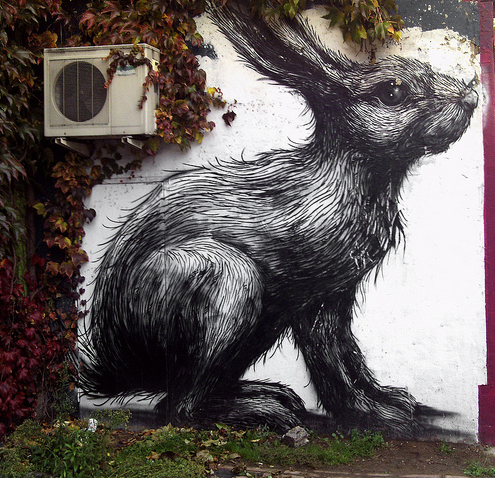
Where is `air conditioning unit`? air conditioning unit is located at coordinates (99, 90).